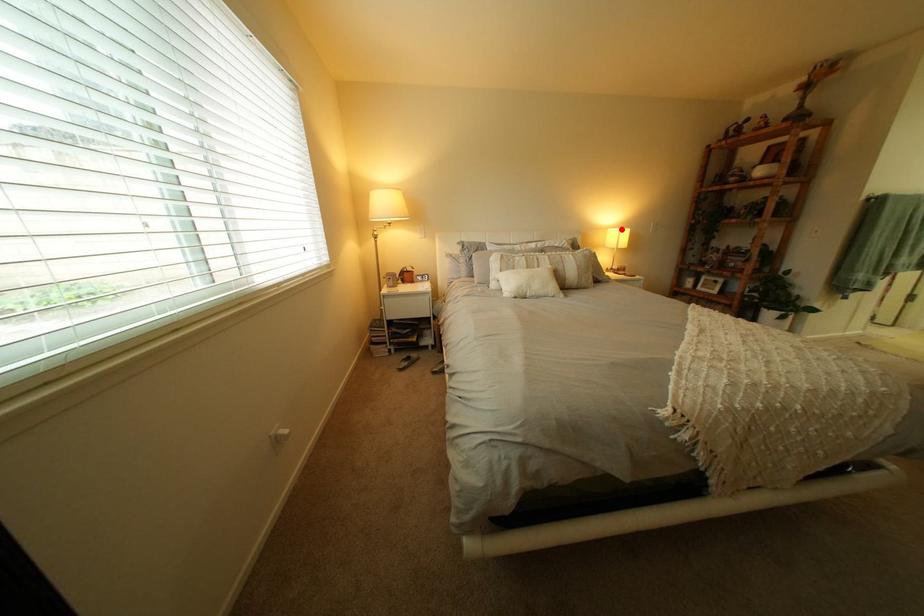
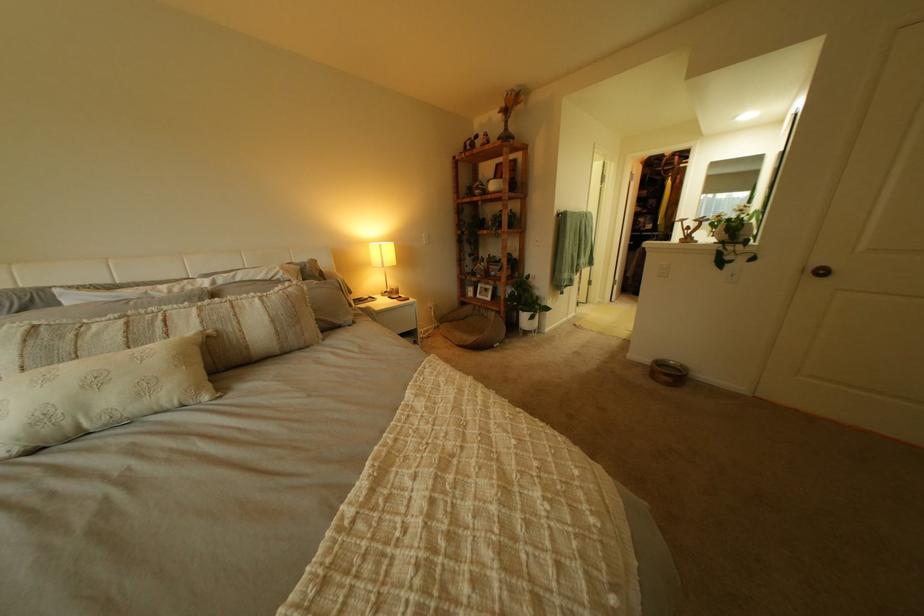
In the second image, find the point that corresponds to the highlighted location in the first image.

(381, 244)